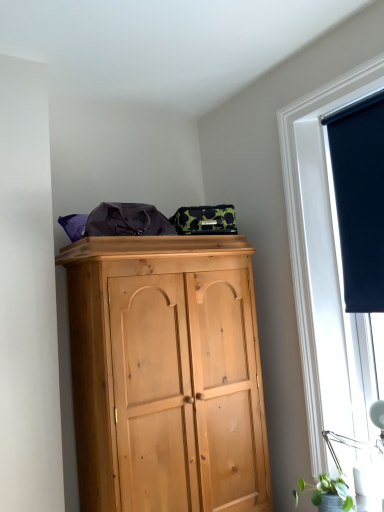
Question: Are dark blue fabric at upper right and green matte plant at lower right beside each other?

Choices:
 (A) yes
 (B) no

Answer: (B)

Question: From a real-world perspective, does dark blue fabric at upper right sit lower than green matte plant at lower right?

Choices:
 (A) yes
 (B) no

Answer: (B)

Question: Is dark blue fabric at upper right taller than green matte plant at lower right?

Choices:
 (A) no
 (B) yes

Answer: (B)

Question: Is green matte plant at lower right at the back of dark blue fabric at upper right?

Choices:
 (A) no
 (B) yes

Answer: (A)

Question: Does dark blue fabric at upper right have a larger size compared to green matte plant at lower right?

Choices:
 (A) yes
 (B) no

Answer: (A)

Question: Considering the relative sizes of dark blue fabric at upper right and green matte plant at lower right in the image provided, is dark blue fabric at upper right thinner than green matte plant at lower right?

Choices:
 (A) yes
 (B) no

Answer: (A)

Question: Could you tell me if green matte plant at lower right is facing matte black roller blind at right?

Choices:
 (A) no
 (B) yes

Answer: (A)

Question: Is the position of green matte plant at lower right more distant than that of matte black roller blind at right?

Choices:
 (A) yes
 (B) no

Answer: (B)

Question: Is green matte plant at lower right wider than matte black roller blind at right?

Choices:
 (A) no
 (B) yes

Answer: (A)

Question: Can you confirm if green matte plant at lower right is smaller than matte black roller blind at right?

Choices:
 (A) yes
 (B) no

Answer: (A)

Question: Does green matte plant at lower right appear on the right side of matte black roller blind at right?

Choices:
 (A) no
 (B) yes

Answer: (A)

Question: Is green matte plant at lower right not near matte black roller blind at right?

Choices:
 (A) yes
 (B) no

Answer: (B)

Question: Is matte black roller blind at right inside dark blue fabric at upper right?

Choices:
 (A) no
 (B) yes

Answer: (A)